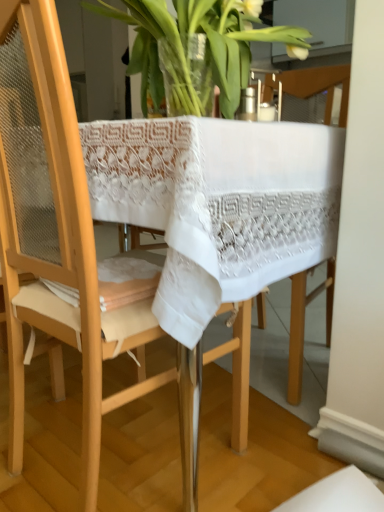
The width and height of the screenshot is (384, 512). What do you see at coordinates (207, 42) in the screenshot? I see `translucent glass vase at upper center` at bounding box center [207, 42].

Measure the distance between point (160, 73) and camera.

Point (160, 73) and camera are 36.38 inches apart.

Where is `translucent glass vase at upper center`? Image resolution: width=384 pixels, height=512 pixels. translucent glass vase at upper center is located at coordinates (207, 42).

Measure the distance between wooden chair at center and camera.

wooden chair at center and camera are 21.06 inches apart from each other.

The image size is (384, 512). What do you see at coordinates (63, 245) in the screenshot?
I see `wooden chair at center` at bounding box center [63, 245].

You are a GUI agent. You are given a task and a screenshot of the screen. Output one action in this format:
    pyautogui.click(x=<x>, y=<y>)
    Task: Click on the wooden chair at center
    The width and height of the screenshot is (384, 512).
    Given the screenshot: What is the action you would take?
    pyautogui.click(x=63, y=245)

Where is `translucent glass vase at upper center`? translucent glass vase at upper center is located at coordinates (207, 42).

Considering the positions of objects wooden chair at center and translucent glass vase at upper center in the image provided, who is more to the right, wooden chair at center or translucent glass vase at upper center?

Positioned to the right is translucent glass vase at upper center.

Which object is further away from the camera taking this photo, wooden chair at center or translucent glass vase at upper center?

translucent glass vase at upper center.

Which is nearer, [50,317] or [196,7]?

Positioned in front is point [50,317].

Consider the image. From the image's perspective, is wooden chair at center beneath translucent glass vase at upper center?

Correct, wooden chair at center appears lower than translucent glass vase at upper center in the image.

From a real-world perspective, which is physically below, wooden chair at center or translucent glass vase at upper center?

From a 3D spatial view, wooden chair at center is below.

Consider the image. Can you confirm if wooden chair at center is thinner than translucent glass vase at upper center?

No, wooden chair at center is not thinner than translucent glass vase at upper center.

From their relative heights in the image, would you say wooden chair at center is taller or shorter than translucent glass vase at upper center?

In the image, wooden chair at center appears to be taller than translucent glass vase at upper center.

Which of these two, wooden chair at center or translucent glass vase at upper center, is bigger?

wooden chair at center.

From the picture: Does wooden chair at center contain translucent glass vase at upper center?

Yes, wooden chair at center is surrounding translucent glass vase at upper center.

Would you consider wooden chair at center to be distant from translucent glass vase at upper center?

That's not correct — wooden chair at center is a little close to translucent glass vase at upper center.

Is wooden chair at center looking in the opposite direction of translucent glass vase at upper center?

No, wooden chair at center is not facing the opposite direction of translucent glass vase at upper center.

Measure the distance from wooden chair at center to translucent glass vase at upper center.

20.48 inches.

The height and width of the screenshot is (512, 384). Find the location of `chair in front of the translucent glass vase at upper center`. chair in front of the translucent glass vase at upper center is located at coordinates (63, 245).

Considering the positions of objects translucent glass vase at upper center and wooden chair at center in the image provided, who is more to the right, translucent glass vase at upper center or wooden chair at center?

Positioned to the right is translucent glass vase at upper center.

Is translucent glass vase at upper center behind wooden chair at center?

Yes, it is.

Is point (156, 42) positioned behind point (13, 112)?

Yes, point (156, 42) is behind point (13, 112).

From the image's perspective, between translucent glass vase at upper center and wooden chair at center, which one is located above?

From the image's view, translucent glass vase at upper center is above.

From a real-world perspective, is translucent glass vase at upper center physically located above or below wooden chair at center?

Clearly, from a real-world perspective, translucent glass vase at upper center is above wooden chair at center.

Considering the sizes of objects translucent glass vase at upper center and wooden chair at center in the image provided, who is thinner, translucent glass vase at upper center or wooden chair at center?

translucent glass vase at upper center is thinner.

Considering the sizes of translucent glass vase at upper center and wooden chair at center in the image, is translucent glass vase at upper center taller or shorter than wooden chair at center?

In the image, translucent glass vase at upper center appears to be shorter than wooden chair at center.

Between translucent glass vase at upper center and wooden chair at center, which one has larger size?

wooden chair at center.

Is translucent glass vase at upper center situated inside wooden chair at center or outside?

translucent glass vase at upper center is contained in wooden chair at center.

Are translucent glass vase at upper center and wooden chair at center beside each other?

No, translucent glass vase at upper center is not next to wooden chair at center.

Is translucent glass vase at upper center looking in the opposite direction of wooden chair at center?

Correct, translucent glass vase at upper center is looking away from wooden chair at center.

The image size is (384, 512). Identify the location of houseplant on the right of wooden chair at center. (207, 42).

At what (x,y) coordinates should I click in order to perform the action: click on houseplant that appears above the wooden chair at center (from the image's perspective). Please return your answer as a coordinate pair (x, y). Looking at the image, I should click on 207,42.

The width and height of the screenshot is (384, 512). I want to click on chair located on the left of translucent glass vase at upper center, so (63, 245).